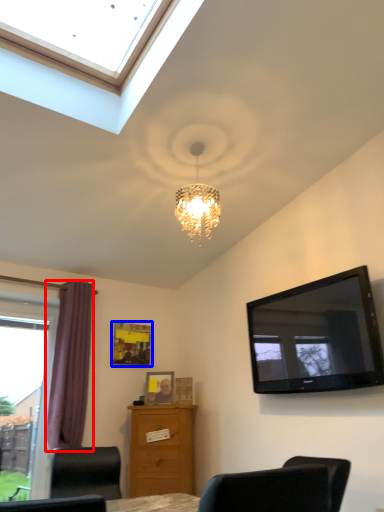
Question: Which of the following is the farthest to the observer, curtain (highlighted by a red box) or picture frame (highlighted by a blue box)?

Choices:
 (A) curtain
 (B) picture frame

Answer: (B)